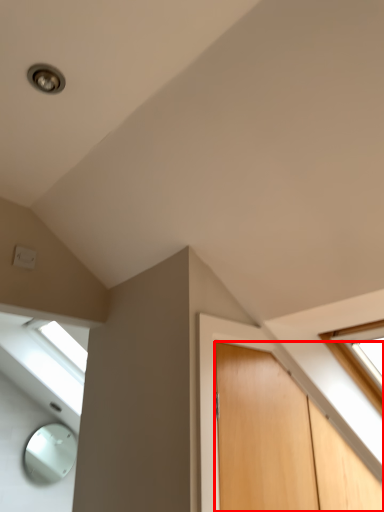
Question: From the image, what is the correct spatial relationship of door (annotated by the red box) in relation to electric outlet?

Choices:
 (A) left
 (B) right

Answer: (B)